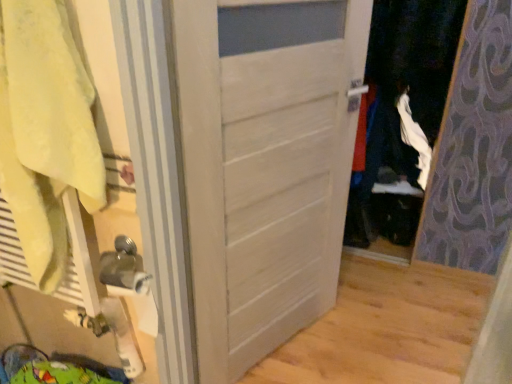
I want to click on yellow cotton bath towel at left, so click(45, 131).

What do you see at coordinates (45, 131) in the screenshot? Image resolution: width=512 pixels, height=384 pixels. I see `yellow cotton bath towel at left` at bounding box center [45, 131].

In order to face white matte door at center, should I rotate leftwards or rightwards?

It's best to rotate right around 3.775 degrees.

What is the approximate width of white matte door at center?

white matte door at center is 2.15 inches wide.

Describe the element at coordinates (265, 165) in the screenshot. I see `white matte door at center` at that location.

What is the approximate height of white matte door at center?

1.42 meters.

The width and height of the screenshot is (512, 384). I want to click on white matte door at center, so click(x=265, y=165).

You are a GUI agent. You are given a task and a screenshot of the screen. Output one action in this format:
    pyautogui.click(x=<x>, y=<y>)
    Task: Click on the yellow cotton bath towel at left
    
    Given the screenshot: What is the action you would take?
    pyautogui.click(x=45, y=131)

Does yellow cotton bath towel at left appear on the right side of white matte door at center?

No.

Which is behind, yellow cotton bath towel at left or white matte door at center?

Positioned behind is white matte door at center.

Which is less distant, [54,112] or [238,297]?

Point [54,112].

From the image's perspective, is yellow cotton bath towel at left on white matte door at center?

Yes, from the image's perspective, yellow cotton bath towel at left is on top of white matte door at center.

From a real-world perspective, between yellow cotton bath towel at left and white matte door at center, who is vertically lower?

In real-world perspective, white matte door at center is lower.

In terms of width, does yellow cotton bath towel at left look wider or thinner when compared to white matte door at center?

In the image, yellow cotton bath towel at left appears to be wider than white matte door at center.

Can you confirm if yellow cotton bath towel at left is taller than white matte door at center?

In fact, yellow cotton bath towel at left may be shorter than white matte door at center.

Who is bigger, yellow cotton bath towel at left or white matte door at center?

Bigger between the two is white matte door at center.

Is yellow cotton bath towel at left situated inside white matte door at center or outside?

yellow cotton bath towel at left is located beyond the bounds of white matte door at center.

Looking at this image, are yellow cotton bath towel at left and white matte door at center making contact?

No, yellow cotton bath towel at left is not in contact with white matte door at center.

Is yellow cotton bath towel at left oriented towards white matte door at center?

No.

Can you tell me how much yellow cotton bath towel at left and white matte door at center differ in facing direction?

There is a 62.5-degree angle between the facing directions of yellow cotton bath towel at left and white matte door at center.

Locate an element on the screen. The width and height of the screenshot is (512, 384). bath towel that is above the white matte door at center (from a real-world perspective) is located at coordinates (45, 131).

Considering the positions of objects white matte door at center and yellow cotton bath towel at left in the image provided, who is more to the left, white matte door at center or yellow cotton bath towel at left?

yellow cotton bath towel at left.

Between white matte door at center and yellow cotton bath towel at left, which one is positioned in front?

yellow cotton bath towel at left.

Does point (205, 141) appear closer or farther from the camera than point (70, 117)?

Clearly, point (205, 141) is more distant from the camera than point (70, 117).

From the image's perspective, does white matte door at center appear higher than yellow cotton bath towel at left?

Actually, white matte door at center appears below yellow cotton bath towel at left in the image.

From a real-world perspective, is white matte door at center above or below yellow cotton bath towel at left?

In terms of real-world spatial position, white matte door at center is below yellow cotton bath towel at left.

In the scene shown: Which of these two, white matte door at center or yellow cotton bath towel at left, is thinner?

white matte door at center is thinner.

Does white matte door at center have a lesser height compared to yellow cotton bath towel at left?

No, white matte door at center is not shorter than yellow cotton bath towel at left.

Is white matte door at center smaller than yellow cotton bath towel at left?

Actually, white matte door at center might be larger than yellow cotton bath towel at left.

Is white matte door at center inside the boundaries of yellow cotton bath towel at left, or outside?

white matte door at center is spatially situated outside yellow cotton bath towel at left.

Is the surface of white matte door at center in direct contact with yellow cotton bath towel at left?

No, white matte door at center is not next to yellow cotton bath towel at left.

Could you tell me if white matte door at center is turned towards yellow cotton bath towel at left?

No, white matte door at center is not oriented towards yellow cotton bath towel at left.

Locate an element on the screen. Image resolution: width=512 pixels, height=384 pixels. bath towel that is in front of the white matte door at center is located at coordinates (45, 131).

This screenshot has width=512, height=384. What are the coordinates of `bath towel above the white matte door at center (from a real-world perspective)` in the screenshot? It's located at (45, 131).

I want to click on door that appears below the yellow cotton bath towel at left (from a real-world perspective), so click(265, 165).